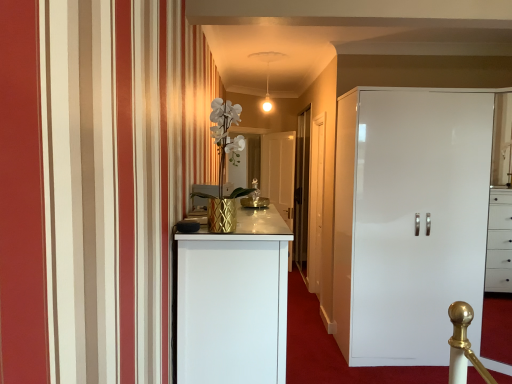
Question: Is white glossy door at center, placed as the second door when sorted from right to left, in front of white textured vase at center?

Choices:
 (A) yes
 (B) no

Answer: (B)

Question: From the image's perspective, would you say white glossy door at center, the first door viewed from the back, is shown under white textured vase at center?

Choices:
 (A) yes
 (B) no

Answer: (A)

Question: Is white glossy door at center, the first door viewed from the back, positioned behind white textured vase at center?

Choices:
 (A) yes
 (B) no

Answer: (A)

Question: Is white glossy door at center, placed as the second door when sorted from right to left, bigger than white textured vase at center?

Choices:
 (A) yes
 (B) no

Answer: (A)

Question: Are white glossy door at center, the first door in the left-to-right sequence, and white textured vase at center located far from each other?

Choices:
 (A) yes
 (B) no

Answer: (A)

Question: Relative to white textured vase at center, is white wooden door at center, the 1th door positioned from the front, in front or behind?

Choices:
 (A) behind
 (B) front

Answer: (A)

Question: From their relative heights in the image, would you say white wooden door at center, the 1th door positioned from the front, is taller or shorter than white textured vase at center?

Choices:
 (A) short
 (B) tall

Answer: (B)

Question: From a real-world perspective, is white wooden door at center, which is the second door in left-to-right order, above or below white textured vase at center?

Choices:
 (A) below
 (B) above

Answer: (A)

Question: In terms of width, does white wooden door at center, which is the second door in left-to-right order, look wider or thinner when compared to white textured vase at center?

Choices:
 (A) wide
 (B) thin

Answer: (B)

Question: Would you say white glossy cupboard at right is inside or outside transparent glass door at center?

Choices:
 (A) outside
 (B) inside

Answer: (A)

Question: Is white glossy cupboard at right in front of or behind transparent glass door at center in the image?

Choices:
 (A) front
 (B) behind

Answer: (A)

Question: Considering the positions of point (417, 271) and point (305, 170), is point (417, 271) closer or farther from the camera than point (305, 170)?

Choices:
 (A) closer
 (B) farther

Answer: (A)

Question: Is white glossy cupboard at right taller or shorter than transparent glass door at center?

Choices:
 (A) tall
 (B) short

Answer: (B)

Question: Is white textured vase at center inside the boundaries of white glossy cupboard at right, or outside?

Choices:
 (A) inside
 (B) outside

Answer: (B)

Question: Relative to white glossy cupboard at right, is white textured vase at center in front or behind?

Choices:
 (A) front
 (B) behind

Answer: (A)